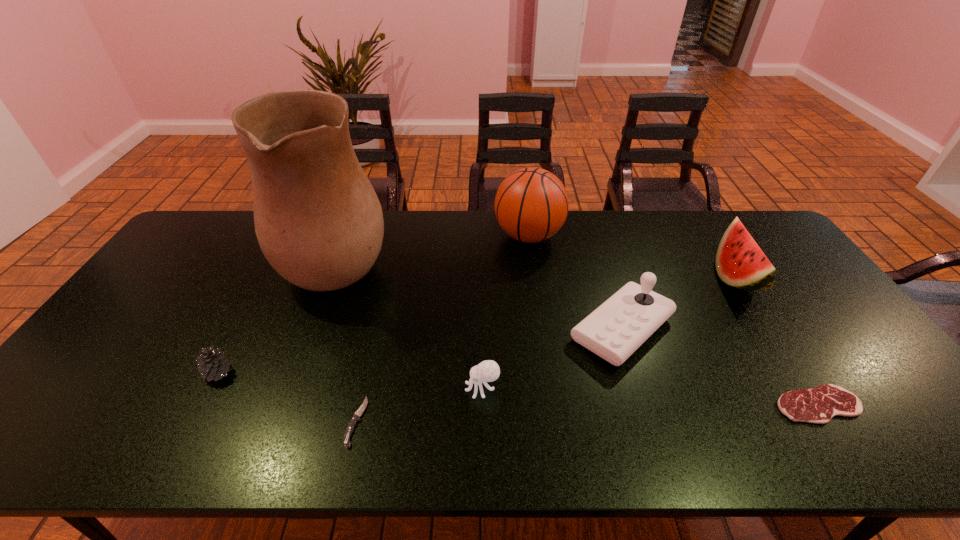
Where is `the tallest object`? the tallest object is located at coordinates (319, 223).

I want to click on the seventh shortest object, so click(531, 204).

At what (x,y) coordinates should I click in order to perform the action: click on watermelon. Please return your answer as a coordinate pair (x, y). Looking at the image, I should click on (740, 262).

This screenshot has height=540, width=960. Find the location of `joystick`. joystick is located at coordinates (616, 329).

Locate an element on the screen. octopus is located at coordinates (487, 371).

Find the location of a particular element. This screenshot has width=960, height=540. pinecone is located at coordinates (213, 365).

Identify the location of steak. This screenshot has height=540, width=960. (819, 405).

Identify the location of pocketknife. (350, 428).

I want to click on vacant space situated at the spout of the cream pitcher, so (x=454, y=256).

The height and width of the screenshot is (540, 960). I want to click on free region located on the right of the basketball, so click(x=638, y=236).